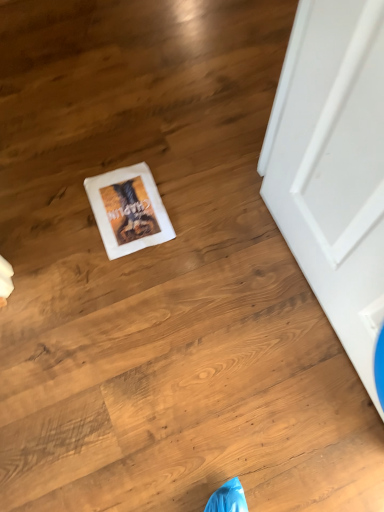
Find the location of `vacant space positioned to the left of white paper postcard at center`. vacant space positioned to the left of white paper postcard at center is located at coordinates (54, 212).